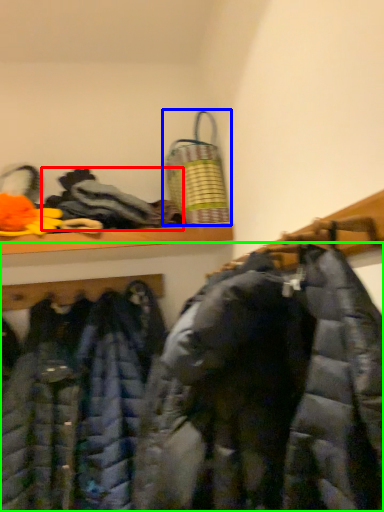
Question: Considering the real-world distances, which object is closest to cloak (highlighted by a red box)? laundry basket (highlighted by a blue box) or jacket (highlighted by a green box).

Choices:
 (A) laundry basket
 (B) jacket

Answer: (A)